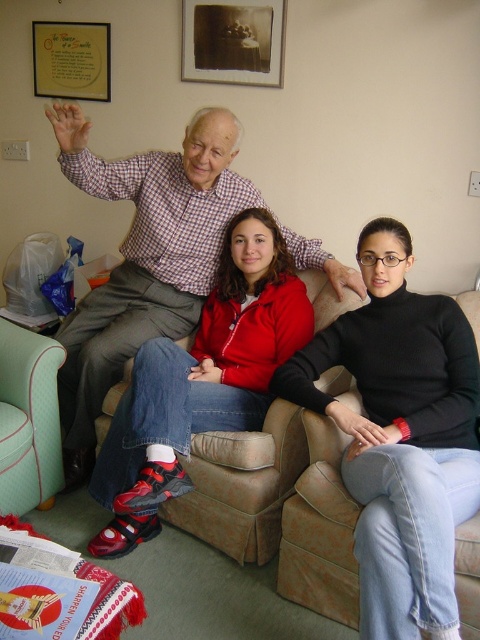
You are a guest entering the living room and want to sit in the mint green fabric armchair at lower left. To reach it, you must pass by the matte black picture frame at upper center. Based on their positions, will you need to move around the frame to get to the chair?

The mint green fabric armchair at lower left is positioned on the left side of the matte black picture frame at upper center. Since the chair is to the left of the frame, you can approach it directly without needing to move around the frame.

In the living room scene, there is a checkered fabric shirt at upper left and a matte red jacket at center. Which object is positioned higher in the image?

The checkered fabric shirt at upper left is positioned higher in the image than the matte red jacket at center according to the description.

You are standing in the living room and want to reach a point that is 1.41 meters away from you. Can you walk straight ahead to reach the point at coordinate point (367, 582)?

The distance between you and the point at coordinate point (367, 582) is 1.41 meters, so yes, you can walk straight ahead to reach it since it is within a reachable distance.